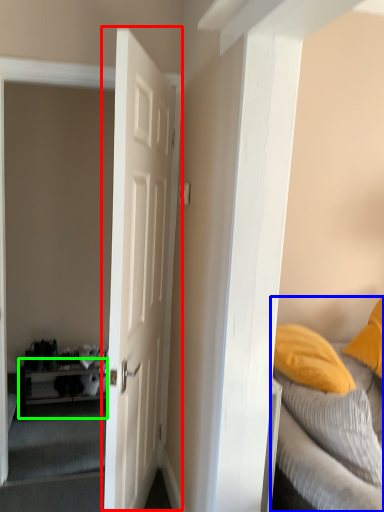
Question: Based on their relative distances, which object is nearer to door (highlighted by a red box)? Choose from bed (highlighted by a blue box) and table (highlighted by a green box).

Choices:
 (A) bed
 (B) table

Answer: (A)